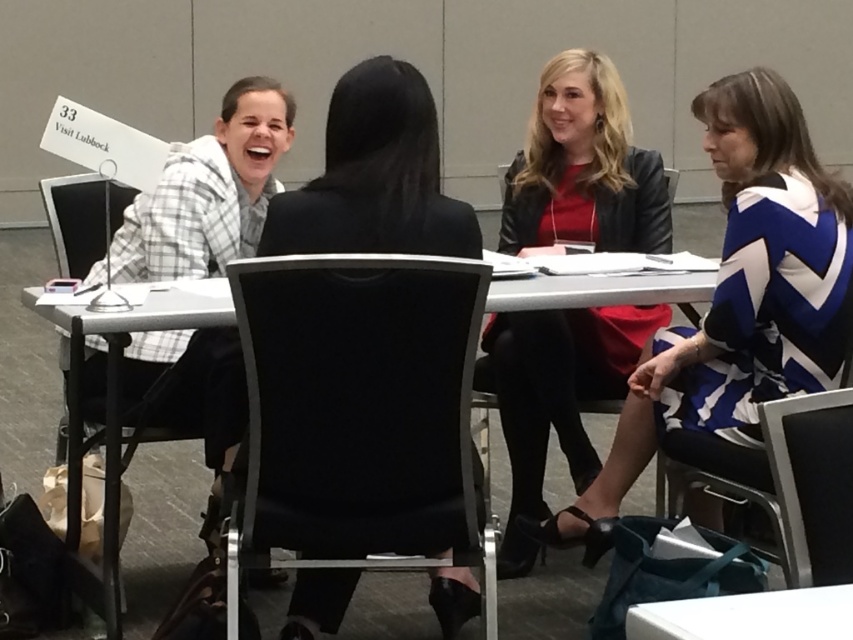
Does point (480, 552) come farther from viewer compared to point (787, 284)?

No, (480, 552) is closer to viewer.

Who is more forward, (440, 433) or (758, 387)?

Point (440, 433) is more forward.

The height and width of the screenshot is (640, 853). Find the location of `black fabric chair at center`. black fabric chair at center is located at coordinates (355, 412).

Who is more forward, (x=840, y=545) or (x=775, y=620)?

Point (x=775, y=620)

Is black leather chair at lower right further to the viewer compared to white glossy table at lower center?

Yes.

Is point (825, 561) closer to camera compared to point (647, 609)?

No.

This screenshot has height=640, width=853. I want to click on black leather chair at lower right, so click(x=811, y=483).

Is matte black dress at center to the left of white glossy table at lower center from the viewer's perspective?

Correct, you'll find matte black dress at center to the left of white glossy table at lower center.

Does matte black dress at center appear over white glossy table at lower center?

Indeed, matte black dress at center is positioned over white glossy table at lower center.

Who is more forward, (613, 396) or (666, 630)?

Positioned in front is point (666, 630).

Image resolution: width=853 pixels, height=640 pixels. In order to click on matte black dress at center in this screenshot , I will do `click(582, 170)`.